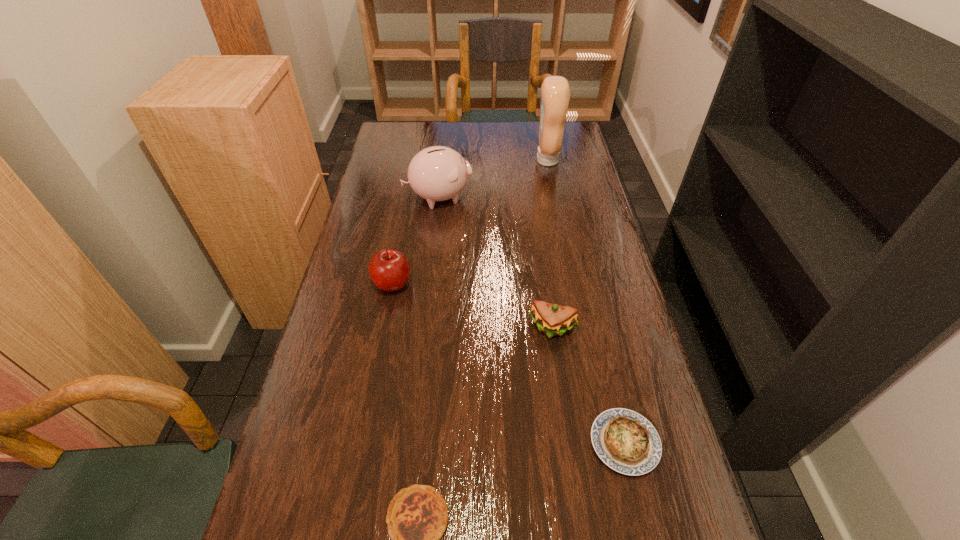
You are a GUI agent. You are given a task and a screenshot of the screen. Output one action in this format:
    pyautogui.click(x=<x>, y=<y>)
    Task: Click on the blank region between the fourth tallest object and the condiment
    The height and width of the screenshot is (540, 960).
    Given the screenshot: What is the action you would take?
    pyautogui.click(x=550, y=244)

At what (x,y) coordinates should I click in order to perform the action: click on empty space between the fourth tallest object and the tallest object. Please return your answer as a coordinate pair (x, y). The height and width of the screenshot is (540, 960). Looking at the image, I should click on (550, 244).

Find the location of a particular element. This screenshot has width=960, height=540. free space between the second farthest object and the farthest object is located at coordinates (492, 178).

Where is `the third closest object to the nearer quiche`? The image size is (960, 540). the third closest object to the nearer quiche is located at coordinates (389, 270).

I want to click on the third closest object to the sandwich, so click(417, 516).